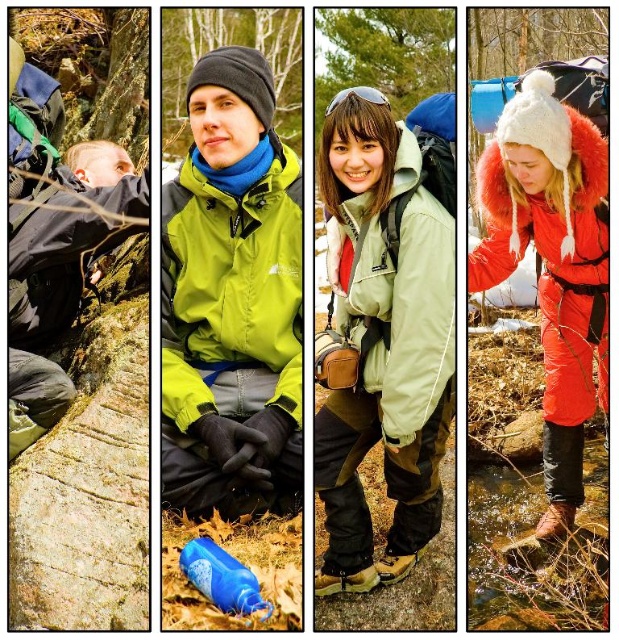
In the scene shown: Does matte green jacket at center have a greater height compared to green matte jacket at center?

Indeed, matte green jacket at center has a greater height compared to green matte jacket at center.

Where is `matte green jacket at center`? matte green jacket at center is located at coordinates (384, 326).

Is point (284, 442) closer to viewer compared to point (535, 205)?

Yes.

Is point (191, 454) farther from camera compared to point (524, 92)?

No, (191, 454) is in front of (524, 92).

The image size is (619, 640). Identify the location of green matte jacket at center. (232, 300).

Does fuzzy white hat at upper right have a larger size compared to blue matte water bottle at center?

Yes.

Is fuzzy white hat at upper right above blue matte water bottle at center?

Correct, fuzzy white hat at upper right is located above blue matte water bottle at center.

Which is in front, point (558, 208) or point (196, 561)?

Point (196, 561) is more forward.

At what (x,y) coordinates should I click in order to perform the action: click on fuzzy white hat at upper right. Please return your answer as a coordinate pair (x, y). The image size is (619, 640). Looking at the image, I should click on (552, 264).